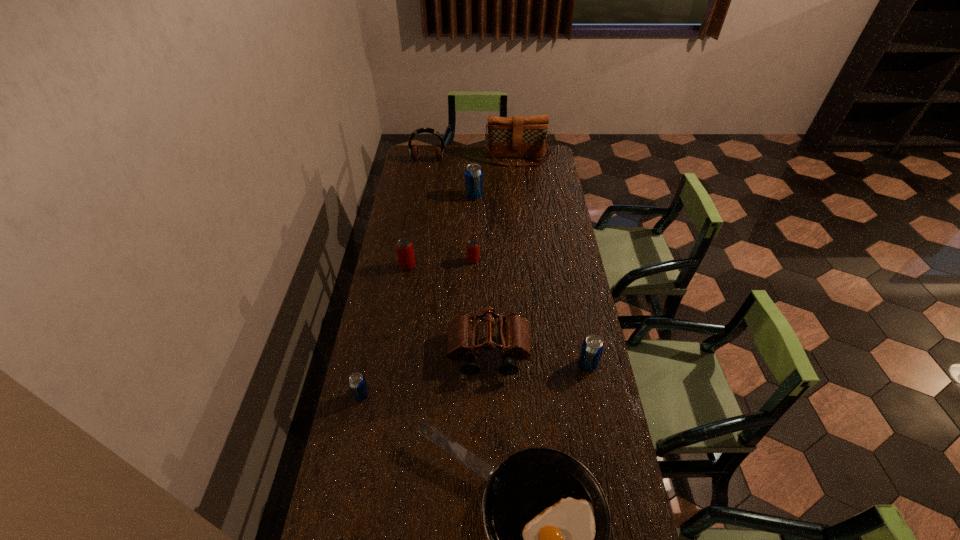
Find the location of `shoulder bag`. shoulder bag is located at coordinates (508, 137).

Where is `brown headset`? This screenshot has height=540, width=960. brown headset is located at coordinates (413, 149).

Where is `the second blue beer can from right to left`? This screenshot has width=960, height=540. the second blue beer can from right to left is located at coordinates (473, 173).

This screenshot has height=540, width=960. Find the location of `the biggest blue beer can`. the biggest blue beer can is located at coordinates (473, 173).

This screenshot has height=540, width=960. Identify the location of binoculars. (463, 330).

Identify the location of the second nearest beer can. The height and width of the screenshot is (540, 960). (592, 347).

Identify the location of the second farthest blue beer can. (592, 347).

Locate an element on the screen. Image resolution: width=960 pixels, height=540 pixels. the fourth beer can from right to left is located at coordinates (405, 252).

At what (x,y) coordinates should I click in order to perform the action: click on the left pink beer can. Please return your answer as a coordinate pair (x, y). Looking at the image, I should click on (405, 252).

Locate an element on the screen. This screenshot has width=960, height=540. the nearest beer can is located at coordinates click(x=357, y=382).